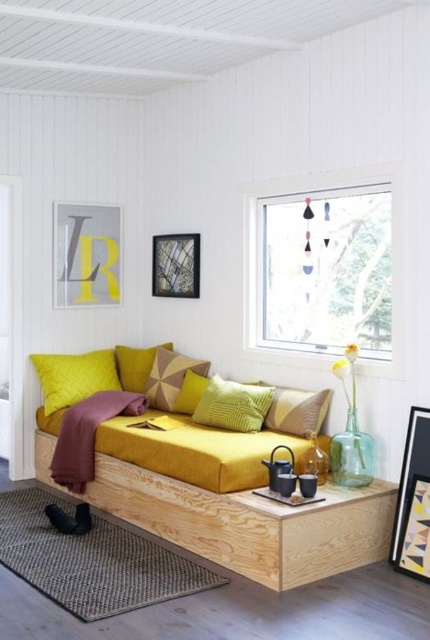
You are arranging a photo shoot in this room and need to place a large camera on the yellow striped pillow at center and the metallic reflective frame at upper center. Which object can accommodate the camera without the camera falling off?

The metallic reflective frame at upper center can accommodate the camera without it falling off because it is larger than the yellow striped pillow at center.

You are arranging a photo shoot in the room and need to position a camera on a tripod. The camera requires a clear view of both the yellow striped pillow at center and the metallic reflective frame at upper center. Given their heights, will the camera be able to capture both objects in the same frame without adjusting its angle?

The yellow striped pillow at center is shorter than the metallic reflective frame at upper center. Since the pillow is shorter, the camera on the tripod can likely capture both objects in the same frame by angling slightly upward to include the taller frame while still showing the pillow below.